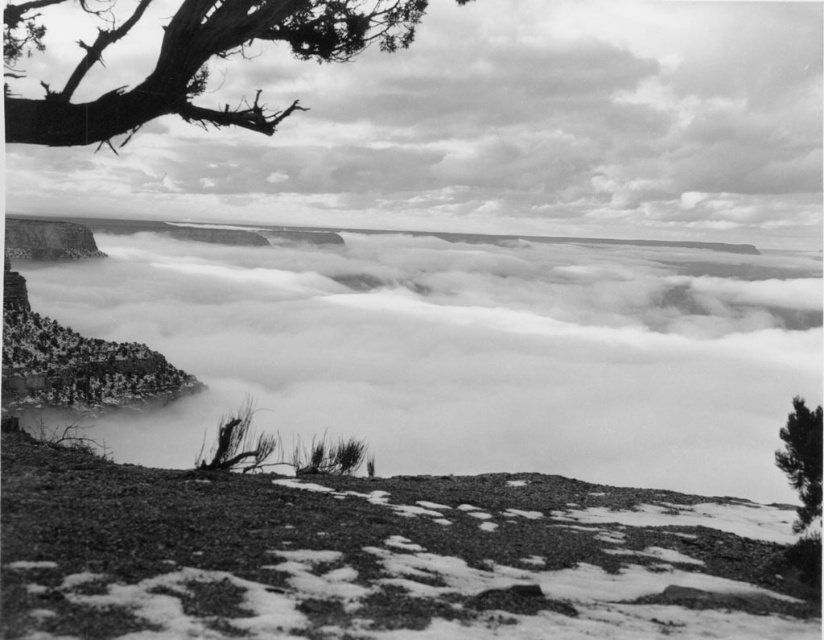
Question: Is fuzzy white cloud at upper center positioned before dead wood tree at upper left?

Choices:
 (A) yes
 (B) no

Answer: (B)

Question: Can you confirm if fuzzy white cloud at upper center is thinner than rough textured dirt at lower center?

Choices:
 (A) no
 (B) yes

Answer: (A)

Question: Among these points, which one is nearest to the camera?

Choices:
 (A) tap(658, 579)
 (B) tap(471, 77)
 (C) tap(803, 474)

Answer: (A)

Question: Considering the real-world distances, which object is closest to the smooth bark tree at upper right?

Choices:
 (A) dead wood tree at upper left
 (B) fuzzy white cloud at upper center

Answer: (A)

Question: Which object is closer to the camera taking this photo?

Choices:
 (A) fuzzy white cloud at upper center
 (B) rough textured dirt at lower center

Answer: (B)

Question: Is the position of dead wood tree at upper left less distant than that of smooth bark tree at upper right?

Choices:
 (A) yes
 (B) no

Answer: (A)